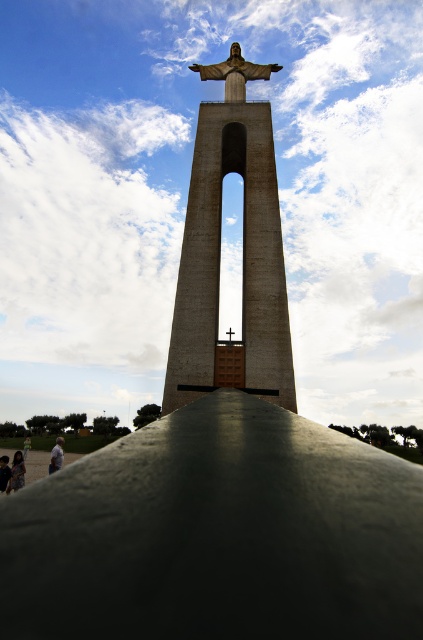
Is light brown shirt at lower left shorter than dark skin person at lower left?

In fact, light brown shirt at lower left may be taller than dark skin person at lower left.

Locate an element on the screen. The width and height of the screenshot is (423, 640). light brown shirt at lower left is located at coordinates (57, 456).

Find the location of `light brown shirt at lower left`. light brown shirt at lower left is located at coordinates (57, 456).

Which is above, concrete statue at center or light brown wooden stick at lower left?

concrete statue at center

Between concrete statue at center and light brown wooden stick at lower left, which one has more height?

concrete statue at center is taller.

Who is more forward, (255,328) or (24,451)?

Point (255,328) is more forward.

You are a GUI agent. You are given a task and a screenshot of the screen. Output one action in this format:
    pyautogui.click(x=<x>, y=<y>)
    Task: Click on the concrete statue at center
    
    Given the screenshot: What is the action you would take?
    pyautogui.click(x=242, y=253)

Is concrete statue at center above dark skin person at lower left?

Indeed, concrete statue at center is positioned over dark skin person at lower left.

Does concrete statue at center have a lesser height compared to dark skin person at lower left?

Incorrect, concrete statue at center's height does not fall short of dark skin person at lower left's.

I want to click on concrete statue at center, so click(242, 253).

The height and width of the screenshot is (640, 423). In order to click on concrete statue at center in this screenshot , I will do [242, 253].